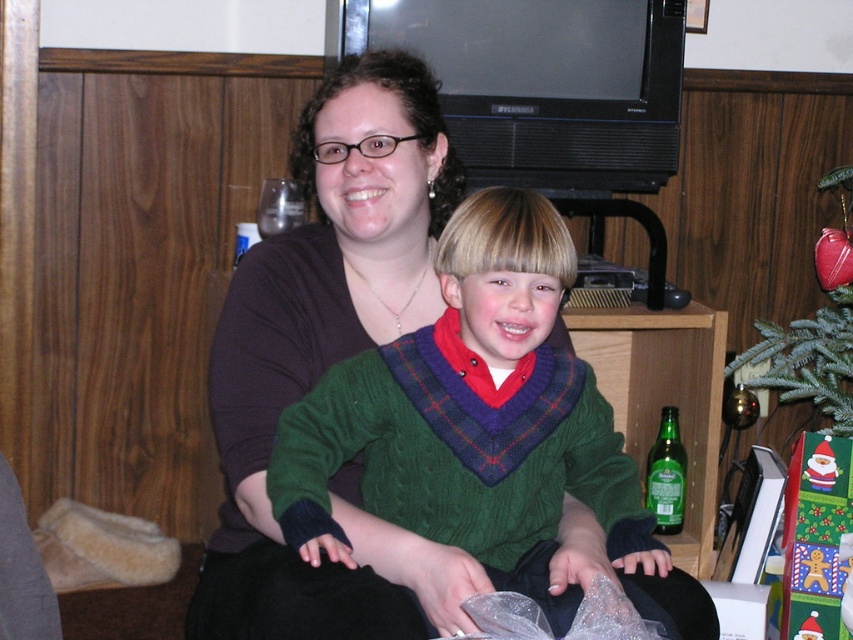
Is green knitted sweater at center shorter than green matte christmas tree at lower right?

Yes.

Between point (540, 220) and point (819, 188), which one is positioned in front?

Point (540, 220) is more forward.

This screenshot has height=640, width=853. Describe the element at coordinates (469, 412) in the screenshot. I see `green knitted sweater at center` at that location.

Identify the location of green knitted sweater at center. (469, 412).